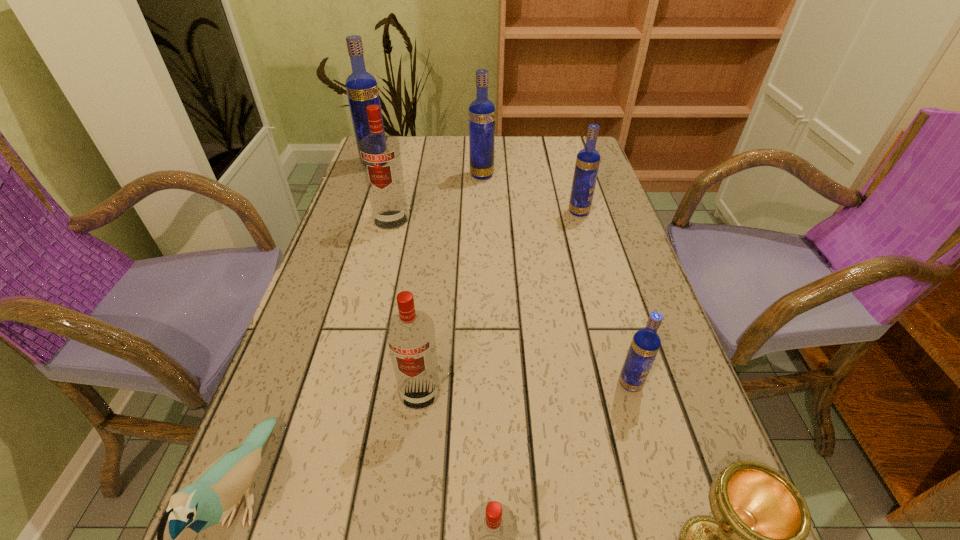
Locate an element on the screen. This screenshot has width=960, height=540. vacant region located 0.070m on the left of the third smallest blue vodka is located at coordinates (446, 175).

At what (x,y) coordinates should I click in order to perform the action: click on free region located 0.290m on the front label of the farthest red vodka. Please return your answer as a coordinate pair (x, y). This screenshot has width=960, height=540. Looking at the image, I should click on (367, 315).

Locate an element on the screen. Image resolution: width=960 pixels, height=540 pixels. free spot located 0.300m on the front of the second nearest blue vodka is located at coordinates (604, 300).

This screenshot has height=540, width=960. I want to click on vacant space located on the front label of the third vodka from left to right, so click(408, 497).

At what (x,y) coordinates should I click in order to perform the action: click on vacant space located 0.320m on the back of the nearest blue vodka. Please return your answer as a coordinate pair (x, y). The height and width of the screenshot is (540, 960). Looking at the image, I should click on (594, 259).

Where is `object that is positioned at the far left corner`? This screenshot has height=540, width=960. object that is positioned at the far left corner is located at coordinates (362, 90).

At what (x,y) coordinates should I click in order to perform the action: click on free space at the far edge of the desktop. Please return your answer as a coordinate pair (x, y). This screenshot has width=960, height=540. Looking at the image, I should click on (448, 151).

Where is `vacant position at the left edge of the desktop`? vacant position at the left edge of the desktop is located at coordinates (389, 233).

Where is `free space at the right edge of the desktop`? The height and width of the screenshot is (540, 960). free space at the right edge of the desktop is located at coordinates (676, 359).

Locate an element on the screen. This screenshot has height=540, width=960. vacant area at the far left corner is located at coordinates (400, 151).